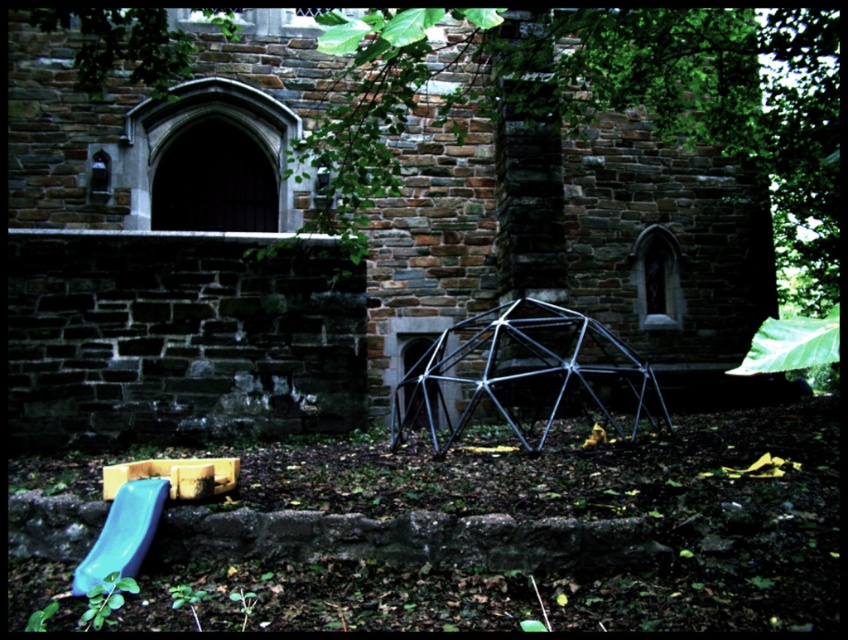
Question: Does stone church at center have a larger size compared to metallic silver geodesic dome at center?

Choices:
 (A) yes
 (B) no

Answer: (A)

Question: In this image, where is stone church at center located relative to matte plastic slide at lower left?

Choices:
 (A) below
 (B) above

Answer: (B)

Question: Which of the following is the farthest from the observer?

Choices:
 (A) metallic silver geodesic dome at center
 (B) stone church at center
 (C) matte plastic slide at lower left

Answer: (B)

Question: Is stone church at center positioned behind metallic silver geodesic dome at center?

Choices:
 (A) no
 (B) yes

Answer: (B)

Question: Considering the real-world distances, which object is farthest from the metallic silver geodesic dome at center?

Choices:
 (A) stone church at center
 (B) matte plastic slide at lower left

Answer: (B)

Question: Which of the following is the closest to the observer?

Choices:
 (A) stone church at center
 (B) matte plastic slide at lower left
 (C) metallic silver geodesic dome at center

Answer: (B)